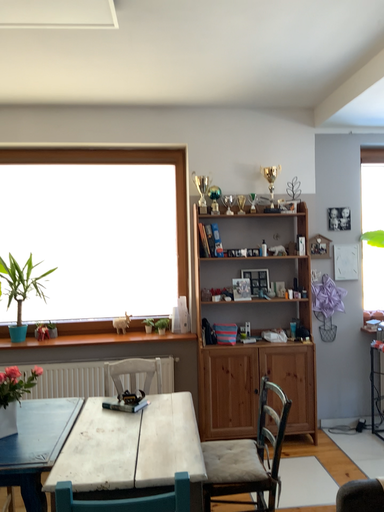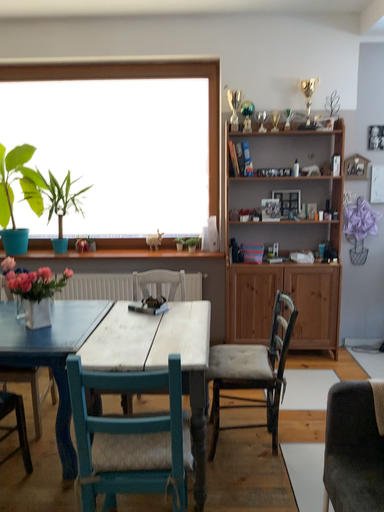
Question: How did the camera likely rotate when shooting the video?

Choices:
 (A) rotated downward
 (B) rotated upward

Answer: (A)